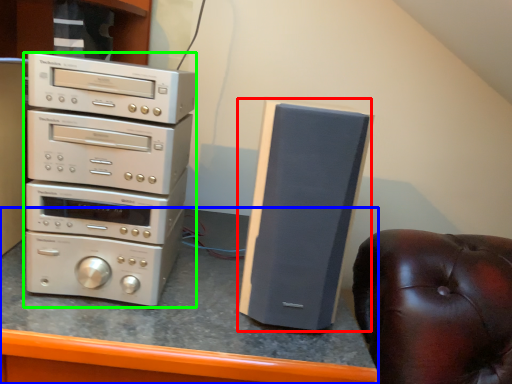
Question: Estimate the real-world distances between objects in this image. Which object is closer to speaker (highlighted by a red box), computer desk (highlighted by a blue box) or home appliance (highlighted by a green box)?

Choices:
 (A) computer desk
 (B) home appliance

Answer: (A)